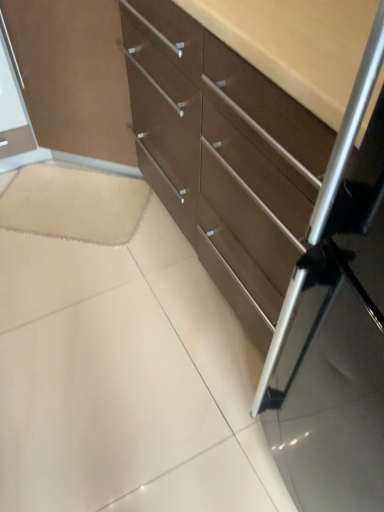
What do you see at coordinates (73, 204) in the screenshot? I see `beige soft carpet at lower left` at bounding box center [73, 204].

Identify the location of beige soft carpet at lower left. (73, 204).

Measure the distance between beige soft carpet at lower left and camera.

beige soft carpet at lower left and camera are 5.13 feet apart.

You are a GUI agent. You are given a task and a screenshot of the screen. Output one action in this format:
    pyautogui.click(x=<x>, y=<y>)
    Task: Click on the matte brown chest of drawers at center
    
    Given the screenshot: What is the action you would take?
    pyautogui.click(x=276, y=238)

The height and width of the screenshot is (512, 384). Describe the element at coordinates (276, 238) in the screenshot. I see `matte brown chest of drawers at center` at that location.

From the picture: Measure the distance between point (350, 396) and camera.

A distance of 23.50 inches exists between point (350, 396) and camera.

Identify the location of beige soft carpet at lower left. This screenshot has width=384, height=512. (73, 204).

Considering the relative positions of beige soft carpet at lower left and matte brown chest of drawers at center in the image provided, is beige soft carpet at lower left to the right of matte brown chest of drawers at center from the viewer's perspective?

Incorrect, beige soft carpet at lower left is not on the right side of matte brown chest of drawers at center.

Which is in front, beige soft carpet at lower left or matte brown chest of drawers at center?

matte brown chest of drawers at center is more forward.

Considering the positions of points (41, 167) and (320, 473), is point (41, 167) closer to camera compared to point (320, 473)?

No, it is not.

From the image's perspective, is beige soft carpet at lower left located beneath matte brown chest of drawers at center?

Indeed, from the image's perspective, beige soft carpet at lower left is shown beneath matte brown chest of drawers at center.

From a real-world perspective, is beige soft carpet at lower left above or below matte brown chest of drawers at center?

beige soft carpet at lower left is situated lower than matte brown chest of drawers at center in the real world.

Based on the photo, between beige soft carpet at lower left and matte brown chest of drawers at center, which one has smaller width?

beige soft carpet at lower left is thinner.

Which of these two, beige soft carpet at lower left or matte brown chest of drawers at center, stands taller?

With more height is matte brown chest of drawers at center.

Which of these two, beige soft carpet at lower left or matte brown chest of drawers at center, is bigger?

matte brown chest of drawers at center.

Would you say beige soft carpet at lower left is inside or outside matte brown chest of drawers at center?

beige soft carpet at lower left is not inside matte brown chest of drawers at center, it's outside.

In the scene shown: Is there a large distance between beige soft carpet at lower left and matte brown chest of drawers at center?

No, there isn't a large distance between beige soft carpet at lower left and matte brown chest of drawers at center.

Is beige soft carpet at lower left facing away from matte brown chest of drawers at center?

beige soft carpet at lower left does not have its back to matte brown chest of drawers at center.

This screenshot has height=512, width=384. I want to click on chest of drawers above the beige soft carpet at lower left (from a real-world perspective), so click(x=276, y=238).

Which object is positioned more to the left, matte brown chest of drawers at center or beige soft carpet at lower left?

beige soft carpet at lower left.

Which is behind, matte brown chest of drawers at center or beige soft carpet at lower left?

Positioned behind is beige soft carpet at lower left.

Between point (337, 271) and point (105, 213), which one is positioned behind?

The point (105, 213) is farther from the camera.

From the image's perspective, is matte brown chest of drawers at center above or below beige soft carpet at lower left?

matte brown chest of drawers at center is situated higher than beige soft carpet at lower left in the image.

From a real-world perspective, is matte brown chest of drawers at center on top of beige soft carpet at lower left?

Yes, from a real-world perspective, matte brown chest of drawers at center is above beige soft carpet at lower left.

Considering the sizes of objects matte brown chest of drawers at center and beige soft carpet at lower left in the image provided, who is thinner, matte brown chest of drawers at center or beige soft carpet at lower left?

beige soft carpet at lower left is thinner.

Which of these two, matte brown chest of drawers at center or beige soft carpet at lower left, stands shorter?

Standing shorter between the two is beige soft carpet at lower left.

Between matte brown chest of drawers at center and beige soft carpet at lower left, which one has smaller size?

With smaller size is beige soft carpet at lower left.

Does matte brown chest of drawers at center contain beige soft carpet at lower left?

No, beige soft carpet at lower left is not a part of matte brown chest of drawers at center.

Would you consider matte brown chest of drawers at center to be distant from beige soft carpet at lower left?

That's not correct — matte brown chest of drawers at center is a little close to beige soft carpet at lower left.

Is matte brown chest of drawers at center oriented towards beige soft carpet at lower left?

Yes, matte brown chest of drawers at center is turned towards beige soft carpet at lower left.

Can you tell me how much matte brown chest of drawers at center and beige soft carpet at lower left differ in facing direction?

The facing directions of matte brown chest of drawers at center and beige soft carpet at lower left are 50.9 degrees apart.

Measure the distance between matte brown chest of drawers at center and beige soft carpet at lower left.

The distance of matte brown chest of drawers at center from beige soft carpet at lower left is 61.14 centimeters.

At what (x,y) coordinates should I click in order to perform the action: click on chest of drawers on the right side of beige soft carpet at lower left. Please return your answer as a coordinate pair (x, y). The width and height of the screenshot is (384, 512). Looking at the image, I should click on (276, 238).

At what (x,y) coordinates should I click in order to perform the action: click on ceramic tile below the matte brown chest of drawers at center (from a real-world perspective). Please return your answer as a coordinate pair (x, y). The height and width of the screenshot is (512, 384). Looking at the image, I should click on (73, 204).

What are the coordinates of `the chest of drawers located in front of the beige soft carpet at lower left` in the screenshot? It's located at coord(276,238).